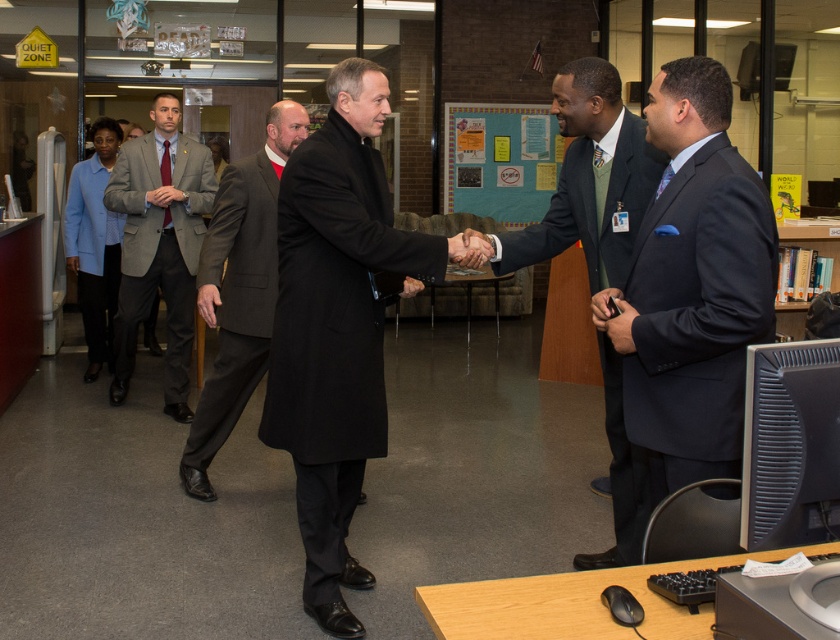
Question: From the image, what is the correct spatial relationship of dark blue suit at center in relation to light blue fabric jacket at left?

Choices:
 (A) left
 (B) right

Answer: (B)

Question: Is black matte coat at center positioned behind light blue fabric jacket at left?

Choices:
 (A) yes
 (B) no

Answer: (B)

Question: Which object appears farthest from the camera in this image?

Choices:
 (A) light blue fabric jacket at left
 (B) gray wool suit at center

Answer: (A)

Question: Which point is farther to the camera?

Choices:
 (A) (655, 176)
 (B) (105, 280)
 (C) (720, 116)

Answer: (B)

Question: Can you confirm if black matte coat at center is thinner than light blue fabric jacket at left?

Choices:
 (A) yes
 (B) no

Answer: (B)

Question: Which of the following is the farthest from the observer?

Choices:
 (A) (680, 214)
 (B) (334, 163)
 (C) (806, 502)
 (D) (189, 314)

Answer: (D)